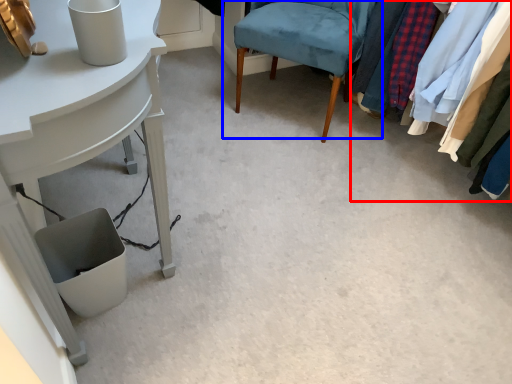
Question: Which object appears closest to the camera in this image, closet (highlighted by a red box) or chair (highlighted by a blue box)?

Choices:
 (A) closet
 (B) chair

Answer: (A)